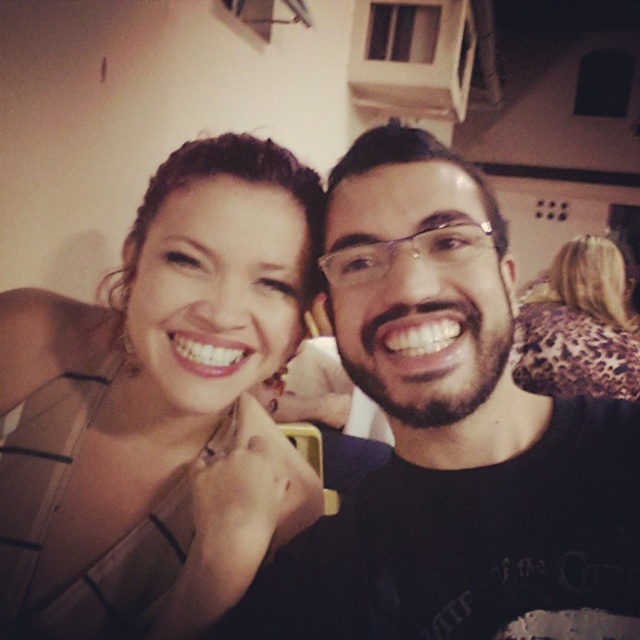
Between point (24, 401) and point (560, 330), which one is positioned in front?

Positioned in front is point (24, 401).

Between satin beige dress at upper left and leopard print scarf at upper right, which one appears on the right side from the viewer's perspective?

leopard print scarf at upper right is more to the right.

Between point (61, 413) and point (580, 369), which one is positioned in front?

Point (61, 413) is more forward.

This screenshot has width=640, height=640. I want to click on satin beige dress at upper left, so click(x=160, y=406).

Measure the distance between black matte shirt at center and leopard print scarf at upper right.

5.40 feet

Which of these two, black matte shirt at center or leopard print scarf at upper right, stands shorter?

Standing shorter between the two is black matte shirt at center.

Is point (490, 360) closer to viewer compared to point (586, 294)?

Yes, point (490, 360) is closer to viewer.

Identify the location of black matte shirt at center. (451, 436).

Can you confirm if satin beige dress at upper left is shorter than black matte shirt at center?

No, satin beige dress at upper left is not shorter than black matte shirt at center.

Can you confirm if satin beige dress at upper left is thinner than black matte shirt at center?

No.

What do you see at coordinates (160, 406) in the screenshot? I see `satin beige dress at upper left` at bounding box center [160, 406].

Locate an element on the screen. satin beige dress at upper left is located at coordinates (160, 406).